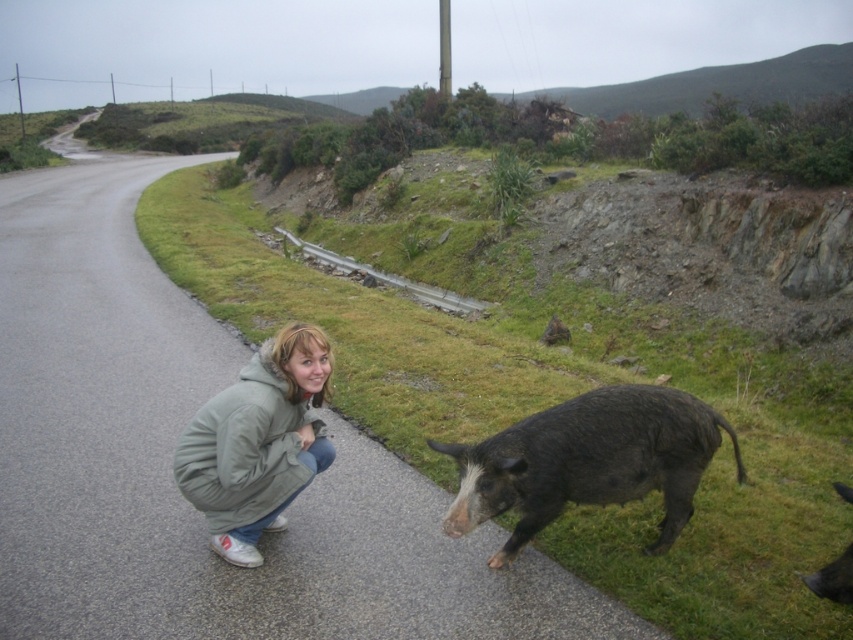
You are a photographer trying to capture a photo of the green fuzzy jacket at lower left and the dark brown fur at lower right. If you want to ensure both subjects are in focus, which one should you focus on first considering their positions?

Since the green fuzzy jacket at lower left might be wider than dark brown fur at lower right, you should focus on the green fuzzy jacket at lower left first to ensure both are in focus.

You are a delivery drone operator. Your drone needs to fly from the dark brown fur pig at road center to the green fuzzy jacket at lower left. What is the minimum horizontal distance the drone must cover?

The minimum horizontal distance the drone must cover is 3.75 feet between the dark brown fur pig at road center and the green fuzzy jacket at lower left.

Looking at this image, you are standing at the camera position and want to throw a ball to the person crouching on the road. You have two target points marked as point 1 at (x=590, y=412) and point 2 at (x=833, y=484). Which point should you aim for if you want the ball to land closer to the camera?

Point 1 at (x=590, y=412) is closer to the camera than point 2 at (x=833, y=484), so you should aim for point 1 at (x=590, y=412) to have the ball land closer to the camera.